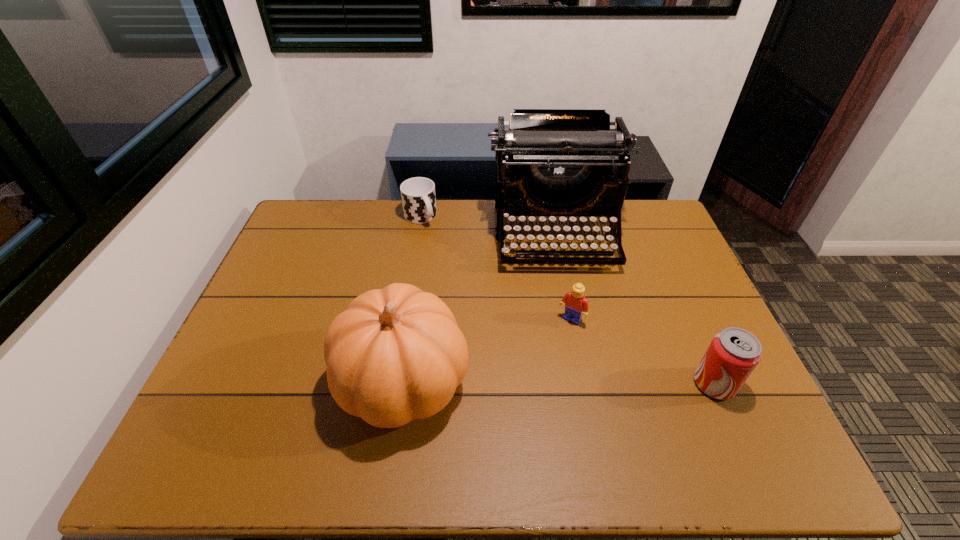
Where is `free point located 0.160m on the side of the cup with the handle`? The image size is (960, 540). free point located 0.160m on the side of the cup with the handle is located at coordinates (447, 255).

I want to click on vacant space located on the front-facing side of the Lego, so click(x=514, y=400).

You are a GUI agent. You are given a task and a screenshot of the screen. Output one action in this format:
    pyautogui.click(x=<x>, y=<y>)
    Task: Click on the vacant region located 0.310m on the front-facing side of the Lego
    The height and width of the screenshot is (540, 960).
    Given the screenshot: What is the action you would take?
    tap(505, 413)

Locate an element on the screen. The width and height of the screenshot is (960, 540). free space located on the front-facing side of the Lego is located at coordinates (526, 382).

Locate an element on the screen. The image size is (960, 540). free space located 0.230m on the typing side of the tallest object is located at coordinates (572, 334).

Locate an element on the screen. The width and height of the screenshot is (960, 540). vacant region located on the typing side of the tallest object is located at coordinates (575, 346).

Where is `free spot located on the typing side of the tallest object`? free spot located on the typing side of the tallest object is located at coordinates (572, 334).

In order to click on cup at the far edge in this screenshot , I will do `click(418, 195)`.

Locate an element on the screen. The width and height of the screenshot is (960, 540). typewriter that is at the far edge is located at coordinates (551, 162).

Identify the location of pumpkin situated at the near edge. (396, 354).